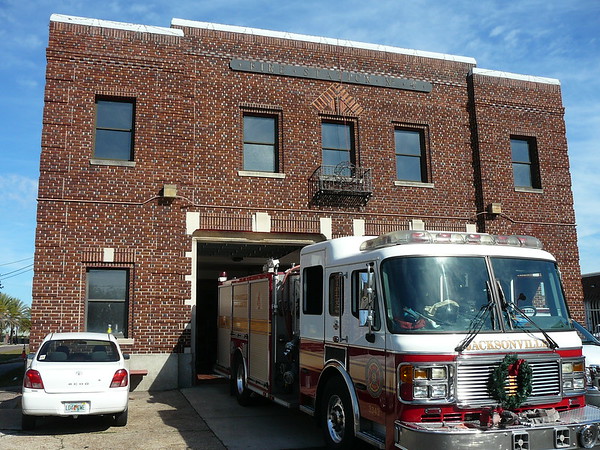
The height and width of the screenshot is (450, 600). Find the location of `window`. window is located at coordinates (112, 320).